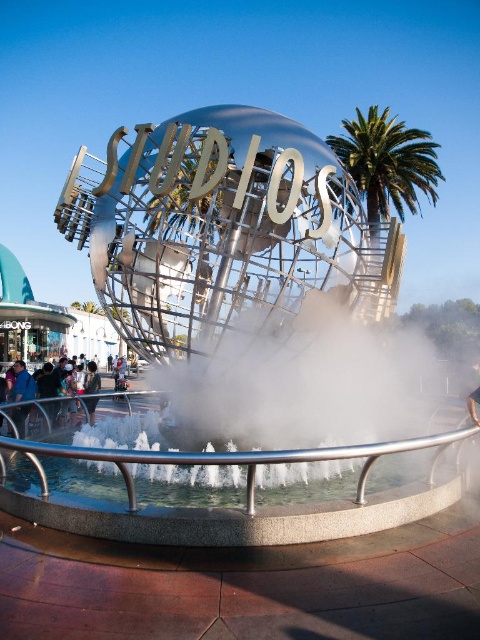
Does green leafy palm tree at upper right appear under dark blue jeans at lower left?

Actually, green leafy palm tree at upper right is above dark blue jeans at lower left.

Which of these two, green leafy palm tree at upper right or dark blue jeans at lower left, stands taller?

Standing taller between the two is green leafy palm tree at upper right.

Between point (374, 196) and point (34, 396), which one is positioned behind?

The point (374, 196) is more distant.

This screenshot has height=640, width=480. I want to click on green leafy palm tree at upper right, so click(x=387, y=163).

Is metallic sphere at center thinner than dark blue jeans at lower left?

No, metallic sphere at center is not thinner than dark blue jeans at lower left.

Between point (149, 269) and point (21, 412), which one is positioned behind?

Point (21, 412)

Does point (248, 458) lie behind point (45, 381)?

No, it is not.

You are a GUI agent. You are given a task and a screenshot of the screen. Output one action in this format:
    pyautogui.click(x=<x>, y=<y>)
    Task: Click on the metallic sphere at center
    
    Given the screenshot: What is the action you would take?
    click(x=237, y=268)

Is point (369, 170) closer to camera compared to point (26, 387)?

No.

Does green leafy palm tree at upper right have a greater width compared to blue fabric shirt at lower left?

Yes, green leafy palm tree at upper right is wider than blue fabric shirt at lower left.

Does point (436, 192) come closer to viewer compared to point (17, 419)?

No, (436, 192) is further to viewer.

Identify the location of green leafy palm tree at upper right. The height and width of the screenshot is (640, 480). (387, 163).